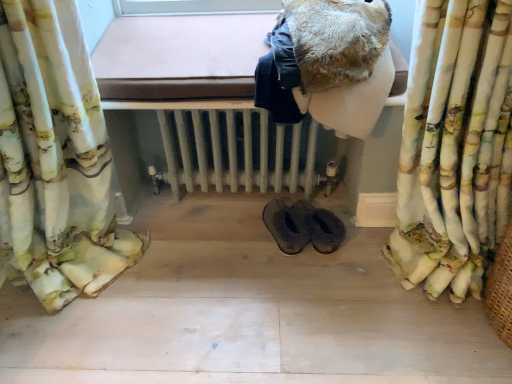
The image size is (512, 384). I want to click on vacant region to the left of fluffy fabric curtain at right, so click(x=330, y=291).